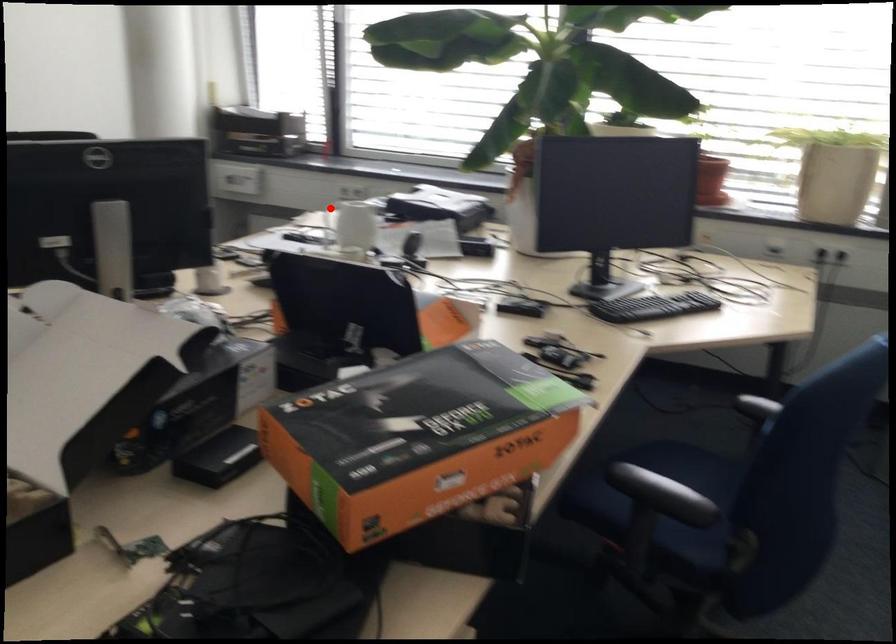
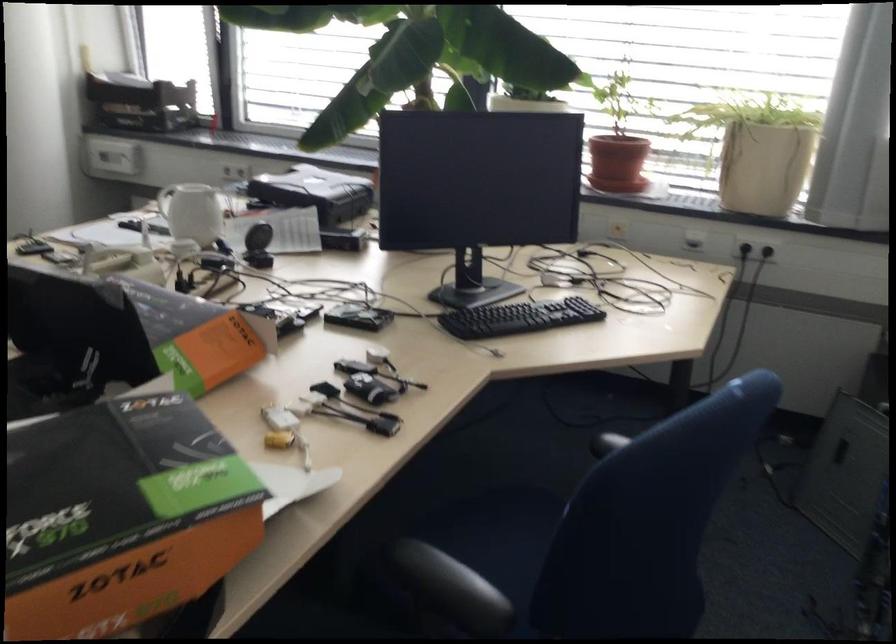
Question: I am providing you with two images of the same scene from different viewpoints. Image1 has a red point marked. In image2, the corresponding 3D location appears at what relative position? Reply with the corresponding letter.

Choices:
 (A) Closer
 (B) Farther

Answer: (A)